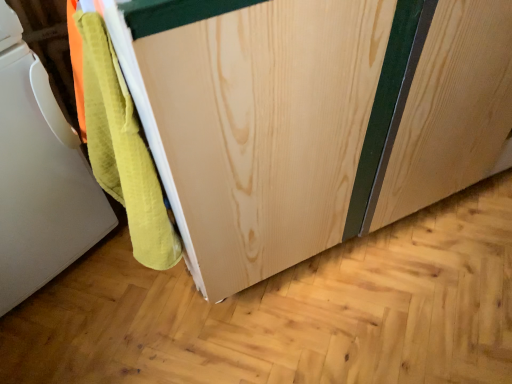
Identify the location of free region under white matte towel at lower left (from a real-world perspective). (163, 291).